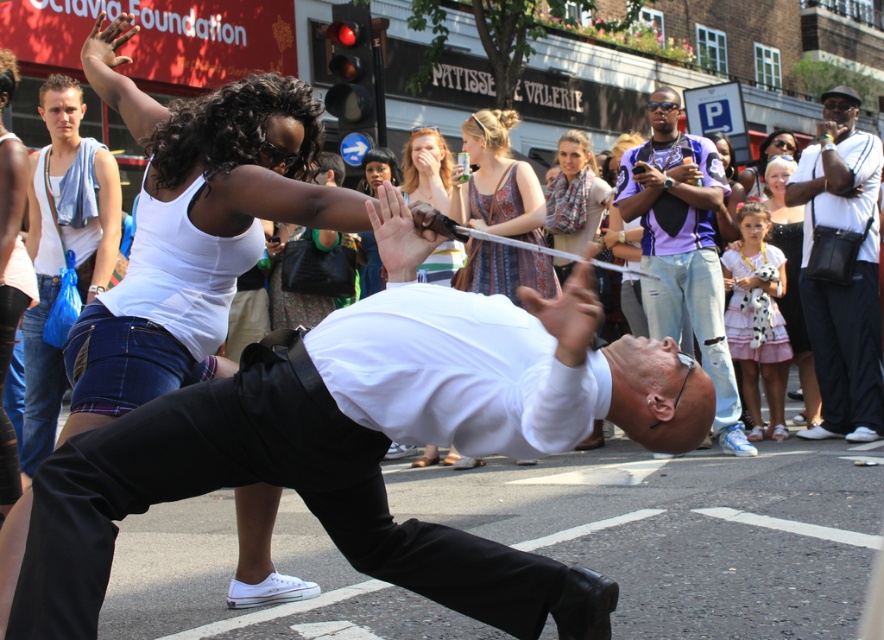
You are a photographer trying to capture the street performers. You notice both the white matte tank top at upper left and the white cotton tank top at upper left. Which one is closer to the camera?

The white matte tank top at upper left is in front of the white cotton tank top at upper left, so it is closer to the camera.

Please provide the 2D coordinates of the white cotton shirt at upper right in the image. The coordinates should be in the format of a point with two decimal places, such as point X, Y.

The white cotton shirt at upper right is located at point (850, 273).